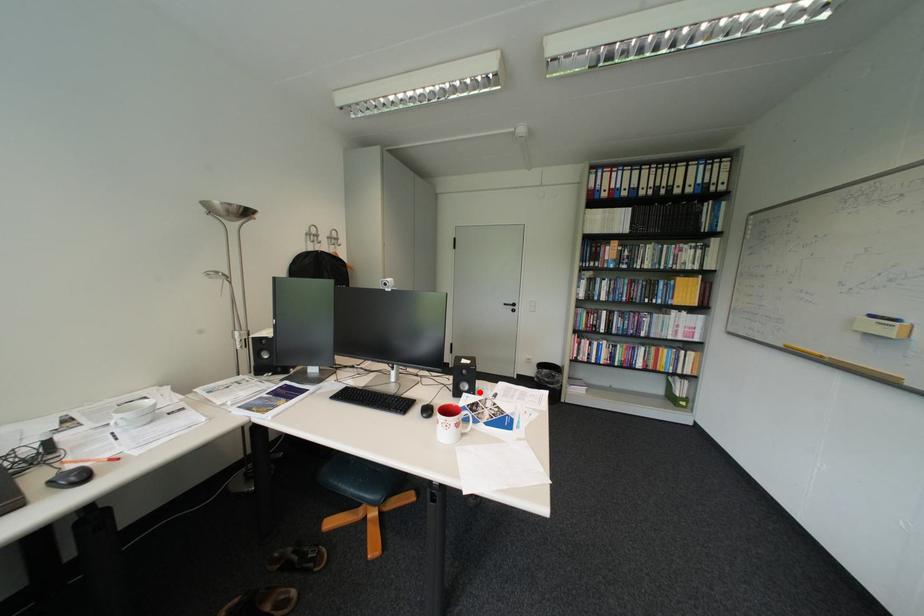
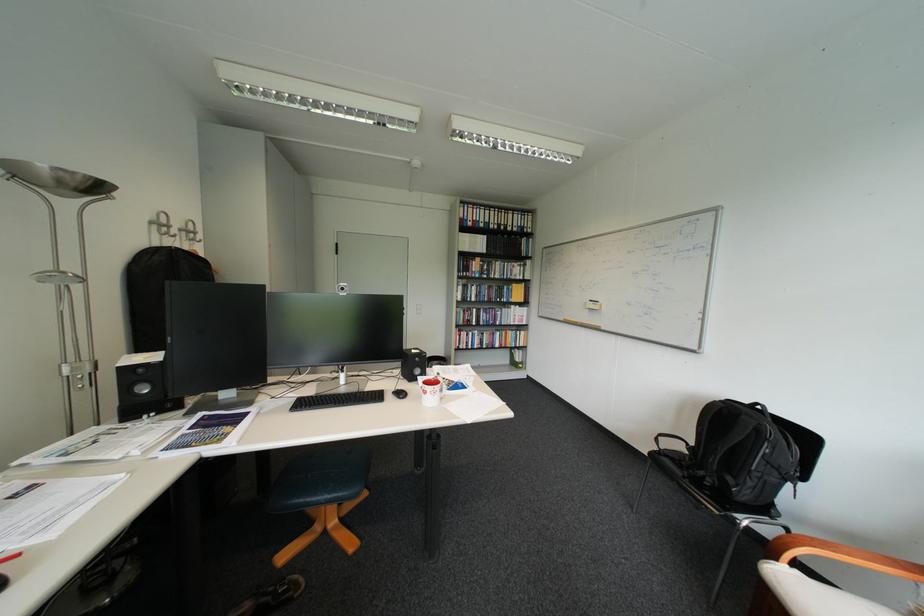
Question: I am providing you with two images of the same scene from different viewpoints. In image1, a red point is highlighted. Considering the same 3D point in image2, which of the following is correct?

Choices:
 (A) It is closer
 (B) It is farther

Answer: (A)